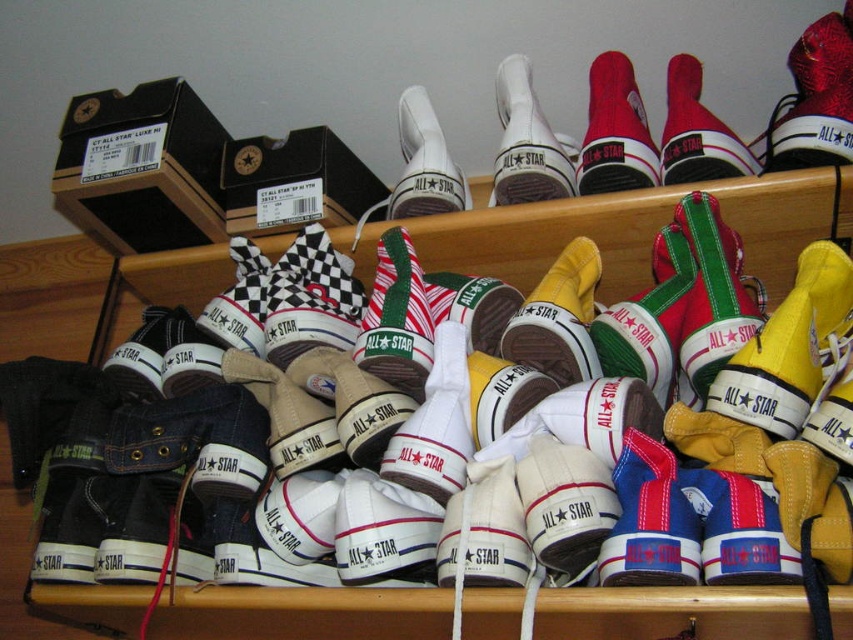
You are a delivery person who needs to place a new pair of Converse All Star sneakers on the wooden shelves. The new pair has a length of 12 inches. The point where you need to place it is at point (651, 163). Can you determine if there is enough space to place the new pair there?

The distance between the point (651, 163) and the camera is 35.53 inches. Since the new pair of sneakers is 12 inches long, there is sufficient space to place them at that point.

You are a delivery person trying to place a new pair of shoes in the display. The new pair must be placed exactly between the white leather shoe at upper center and the red canvas sneaker at upper right. What is the minimum distance you need to leave between the new pair and each existing shoe?

The white leather shoe at upper center and red canvas sneaker at upper right are 15.19 centimeters apart from each other. To place the new pair exactly between them, the minimum distance between the new pair and each existing shoe should be half of 15.19 cm, which is approximately 7.595 centimeters.

You are standing in front of the Converse All Star sneaker display. There are two points marked on the image at coordinates point (318, 166) and point (498, 170). Which point is closer to you?

Point (318, 166) is closer to you because it is further to the viewer than point (498, 170).